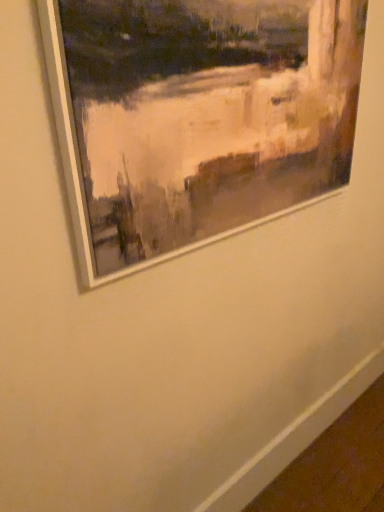
This screenshot has height=512, width=384. I want to click on white matte picture frame at upper center, so click(197, 118).

What is the approximate width of white matte picture frame at upper center?

white matte picture frame at upper center is 9.94 centimeters wide.

Image resolution: width=384 pixels, height=512 pixels. Describe the element at coordinates (197, 118) in the screenshot. I see `white matte picture frame at upper center` at that location.

What are the coordinates of `white matte picture frame at upper center` in the screenshot? It's located at (197, 118).